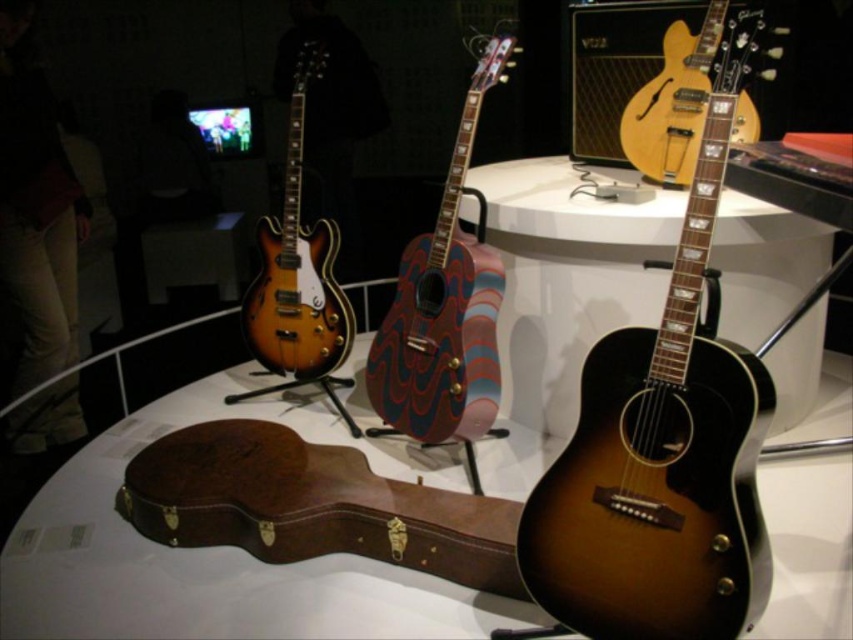
You are a photographer setting up for a shoot. You need to place a light 1.5 meters away from the satin wood guitar at center to avoid harsh shadows. Is the current distance sufficient?

The satin wood guitar at center is currently 1.36 meters away from the camera. Since the required distance is 1.5 meters, the current distance is insufficient. Move the light slightly further back to achieve the desired distance.

You are a photographer setting up a shoot for a music magazine. You need to position a light source to highlight both the multicolored wood acoustic guitar at center and the sunburst wood electric guitar at upper right. Given their sizes, which guitar should you focus the light on first to ensure it captures the full height of both?

The multicolored wood acoustic guitar at center is much taller than the sunburst wood electric guitar at upper right, so you should focus the light on the multicolored wood acoustic guitar at center first to ensure its full height is captured before adjusting for the smaller sunburst wood electric guitar at upper right.

You are a photographer setting up equipment in the room. You need to capture a clear photo of the satin wood guitar at center without the satin wood electric guitar at upper center appearing in the background. Is this possible based on their positions?

Yes, the satin wood guitar at center is in front of the satin wood electric guitar at upper center, so positioning the camera to focus on the satin wood guitar at center while ensuring the electric guitar is out of the frame would allow a clear photo without the background interference.